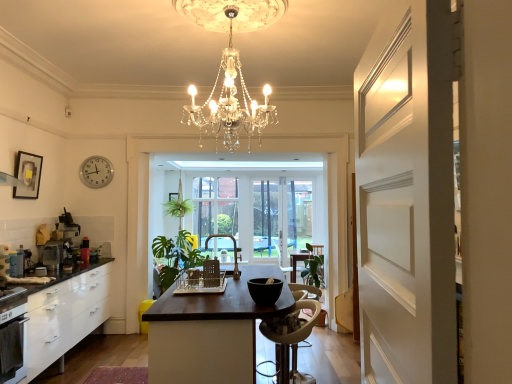
Question: Visually, is metallic silver toaster at left, which is the second appliance in back-to-front order, positioned to the left or to the right of white matte door at right?

Choices:
 (A) right
 (B) left

Answer: (B)

Question: From a real-world perspective, is metallic silver toaster at left, the 3th appliance when ordered from right to left, above or below white matte door at right?

Choices:
 (A) below
 (B) above

Answer: (A)

Question: Estimate the real-world distances between objects in this image. Which object is closer to the metallic silver toaster at left, which is the second appliance in back-to-front order?

Choices:
 (A) white plastic chair at center, which is the 1th chair from front to back
 (B) white matte door at right
 (C) white plastic clock at upper left
 (D) black matte bowl at center, which appears as the 3th appliance when viewed from the left
 (E) matte gold faucet at center, marked as the 2th chair in a right-to-left arrangement

Answer: (C)

Question: Considering the real-world distances, which object is farthest from the black matte bowl at center, which is the first appliance in front-to-back order?

Choices:
 (A) black matte oven at lower left
 (B) matte black picture frame at upper left
 (C) white plastic clock at upper left
 (D) white plastic chair at center, which is the third chair in top-to-bottom order
 (E) green leafy plant at center

Answer: (E)